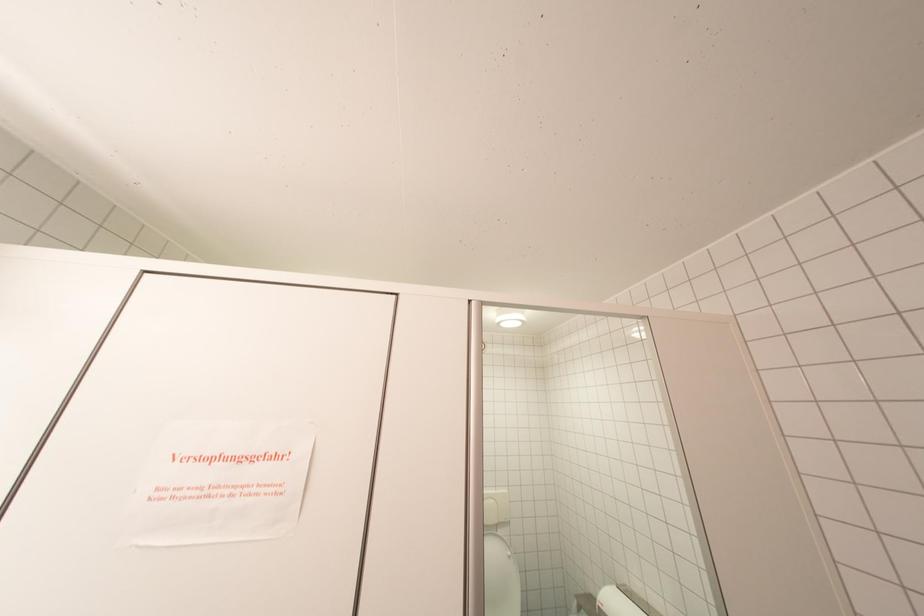
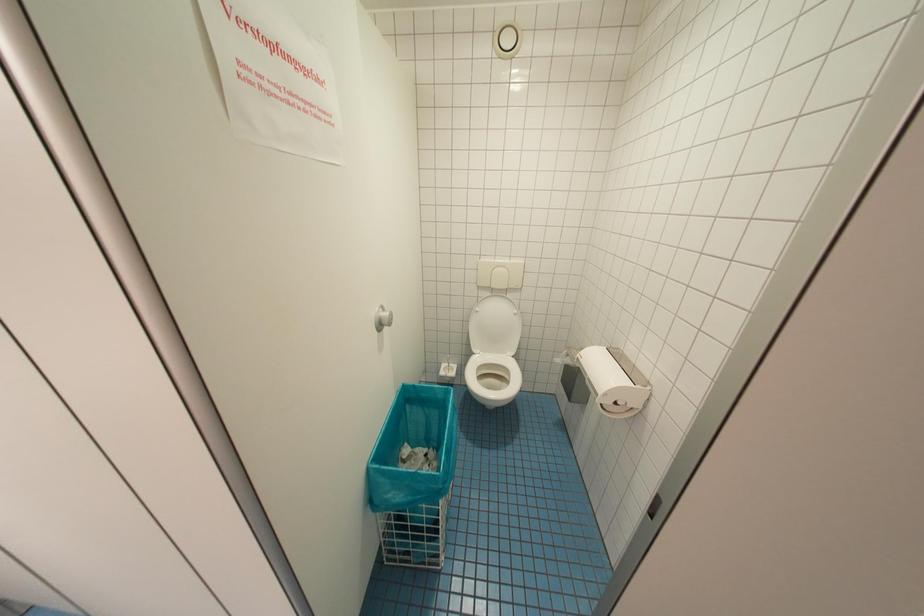
In the scene shown: The images are taken continuously from a first-person perspective. In which direction is your viewpoint rotating?

The camera rotated toward left-down.